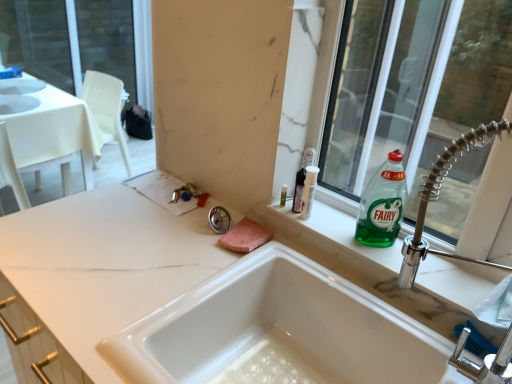
Find the location of a particular element. vacant space underneath transparent glass window at upper right (from a real-world perspective) is located at coordinates (397, 235).